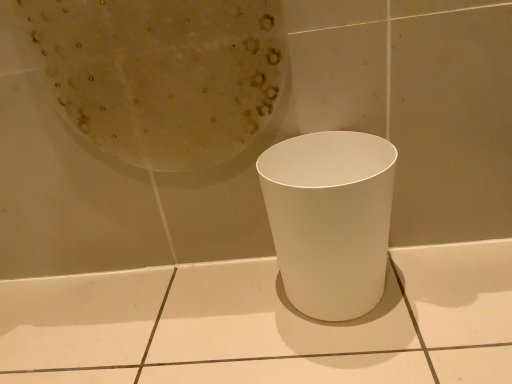
Identify the location of blank space to the left of white matte waste container at center. The height and width of the screenshot is (384, 512). (228, 314).